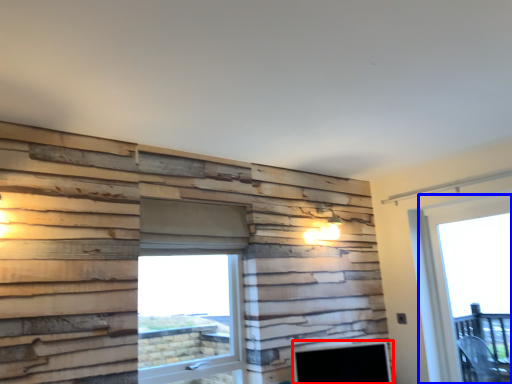
Question: Among these objects, which one is nearest to the camera, fireplace (highlighted by a red box) or window (highlighted by a blue box)?

Choices:
 (A) fireplace
 (B) window

Answer: (A)